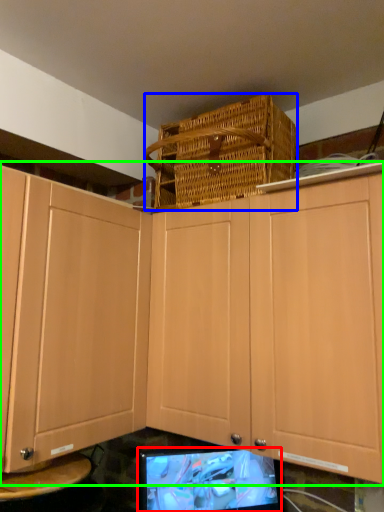
Question: Which is nearer to the computer monitor (highlighted by a red box)? basket (highlighted by a blue box) or cabinetry (highlighted by a green box).

Choices:
 (A) basket
 (B) cabinetry

Answer: (B)